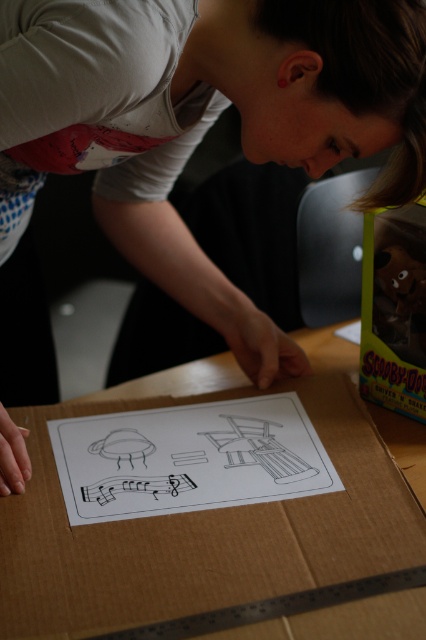
You are holding a camera and want to take a photo of the brown cardboard box at center. The camera requires a minimum distance of 20 inches to focus properly. Can you take a clear photo from your current position?

The brown cardboard box at center and camera are 20.12 inches apart, which is slightly more than the minimum required distance of 20 inches. Therefore, you can take a clear photo from your current position.

You are organizing a small event and need to place the brown cardboard box at center and the translucent plastic toy at upper right on a shelf. If the shelf has limited space, which object should be placed first to ensure both fit properly?

The brown cardboard box at center should be placed first since it is to the left of the translucent plastic toy at upper right, so positioning it first ensures there is enough space for both items on the shelf.